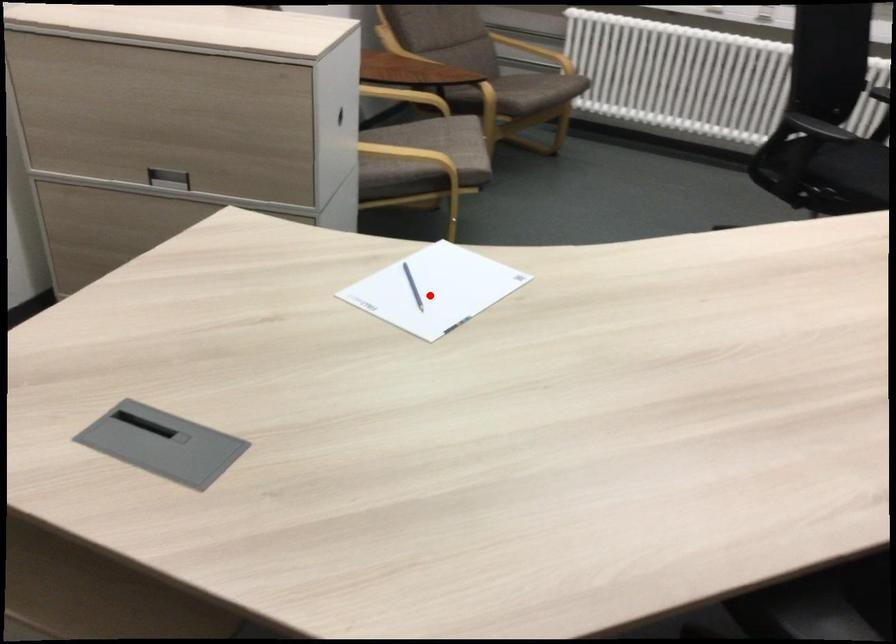
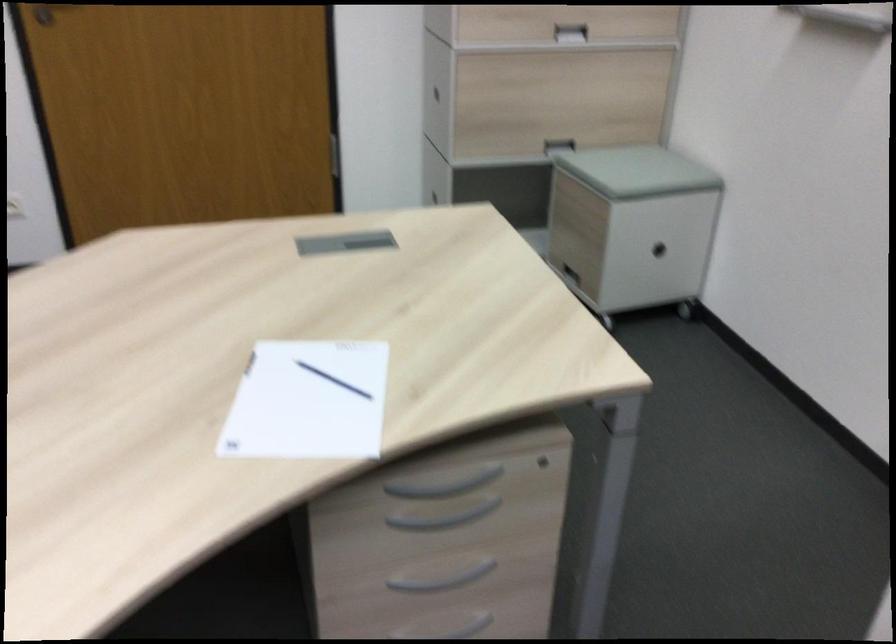
Question: I am providing you with two images of the same scene from different viewpoints. Image1 has a red point marked. In image2, the corresponding 3D location appears at what relative position? Reply with the corresponding letter.

Choices:
 (A) Closer
 (B) Farther

Answer: (A)